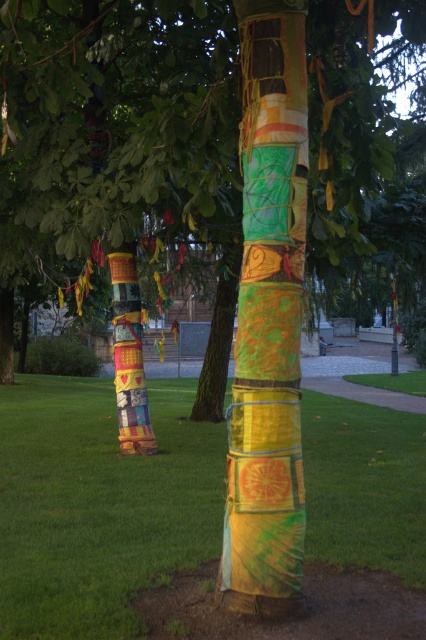
You are planning to set up a picnic blanket in the park scene. You see the green grass at lower center and the multicolored fabric wrapped tree trunk at center. Which area would be more suitable for placing a picnic blanket, and why?

The green grass at lower center is more suitable for placing a picnic blanket because it has a larger size compared to the multicolored fabric wrapped tree trunk at center, providing enough space for the blanket.

You are standing at the entrance of the park and want to find the tree with the most colorful fabrics. According to the coordinates provided, where should you look to find the tree at point (114, 125)?

The tree at point (114, 125) is the textured fabric tree at center, so you should look towards the center of the park to find it.